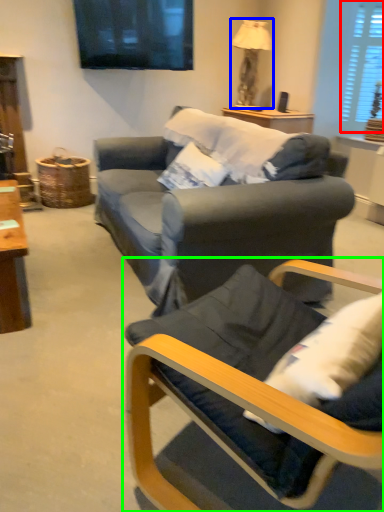
Question: Which is farther away from window (highlighted by a red box)? lamp (highlighted by a blue box) or chair (highlighted by a green box)?

Choices:
 (A) lamp
 (B) chair

Answer: (B)